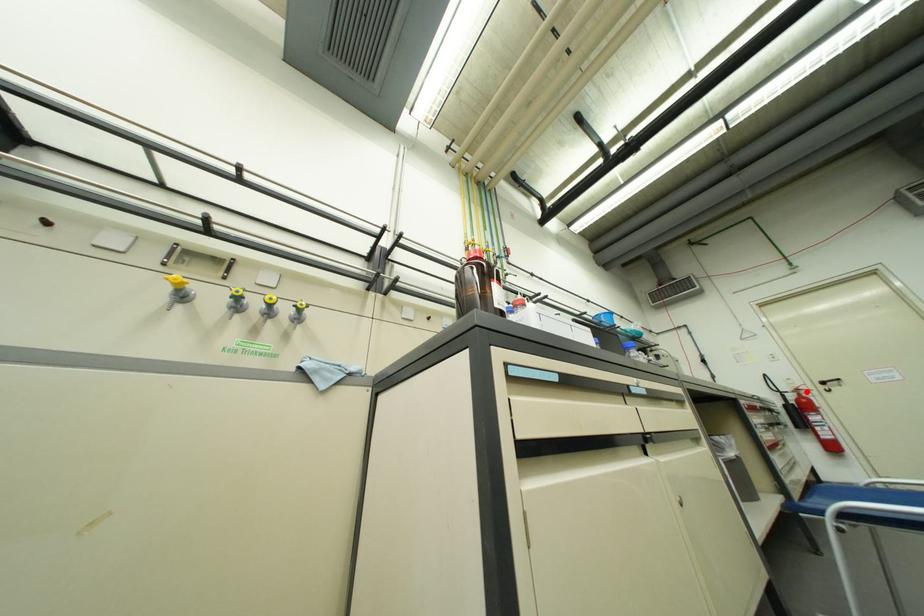
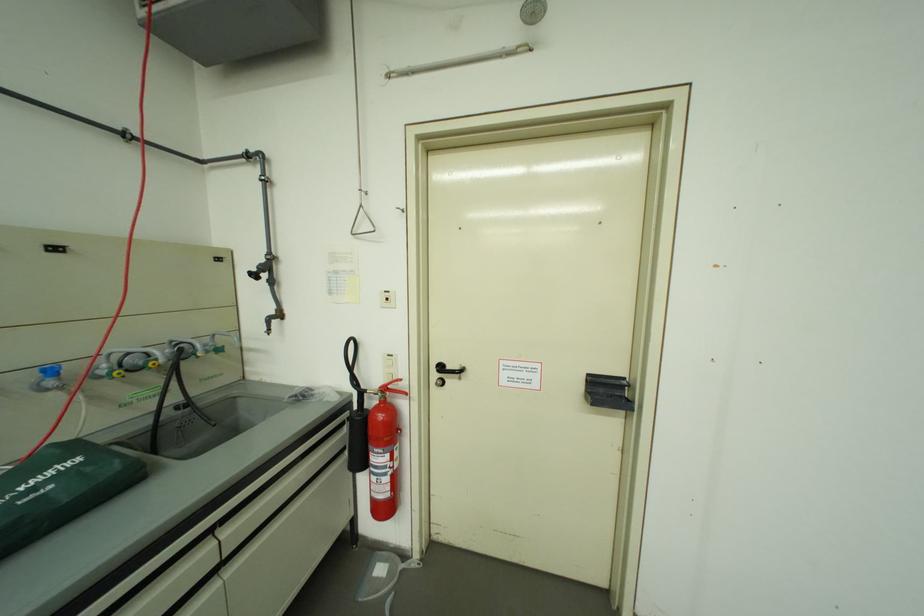
In the second image, find the point that corresponds to the highlighted location in the first image.

(394, 391)